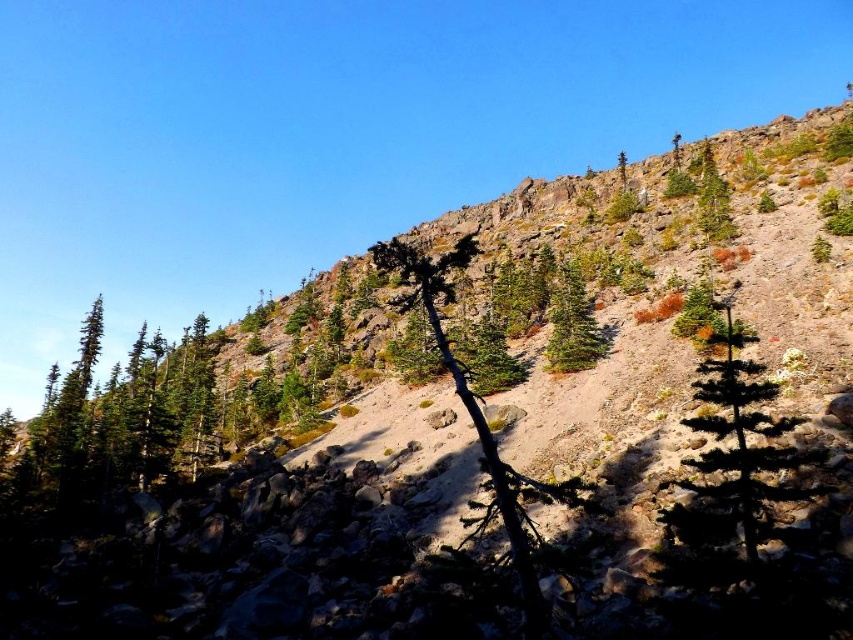
Does point (701, 506) lie in front of point (419, 284)?

Yes.

Is green matte tree at center-right above green rough bark tree at center?

Incorrect, green matte tree at center-right is not positioned above green rough bark tree at center.

Which is in front, point (692, 426) or point (448, 348)?

Positioned in front is point (692, 426).

Where is `green matte tree at center-right`? The image size is (853, 640). green matte tree at center-right is located at coordinates 735,452.

Can you confirm if green matte tree at center-right is shorter than green matte tree at upper center?

Yes.

Who is higher up, green matte tree at center-right or green matte tree at upper center?

green matte tree at upper center

Does point (793, 424) come closer to viewer compared to point (622, 180)?

Yes, point (793, 424) is closer to viewer.

In order to click on green matte tree at center-right in this screenshot , I will do `click(735, 452)`.

Which is below, green rough bark tree at center or green matte tree at upper center?

green rough bark tree at center is below.

What do you see at coordinates (479, 419) in the screenshot? I see `green rough bark tree at center` at bounding box center [479, 419].

Image resolution: width=853 pixels, height=640 pixels. I want to click on green rough bark tree at center, so click(479, 419).